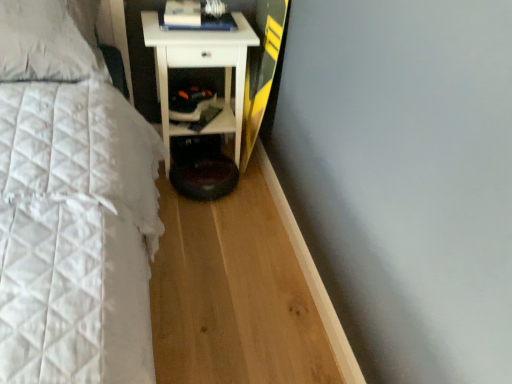
Question: In the image, is white glossy cabinet at lower center positioned in front of or behind white glossy nightstand at center?

Choices:
 (A) front
 (B) behind

Answer: (B)

Question: Considering the positions of point (206, 132) and point (220, 117), is point (206, 132) closer or farther from the camera than point (220, 117)?

Choices:
 (A) closer
 (B) farther

Answer: (A)

Question: Estimate the real-world distances between objects in this image. Which object is farther from the white glossy cabinet at lower center?

Choices:
 (A) white quilted pillow at upper left
 (B) white glossy nightstand at center
 (C) hardcover book at upper center

Answer: (A)

Question: Which object is the closest to the white glossy cabinet at lower center?

Choices:
 (A) white quilted pillow at upper left
 (B) hardcover book at upper center
 (C) white glossy nightstand at center

Answer: (C)